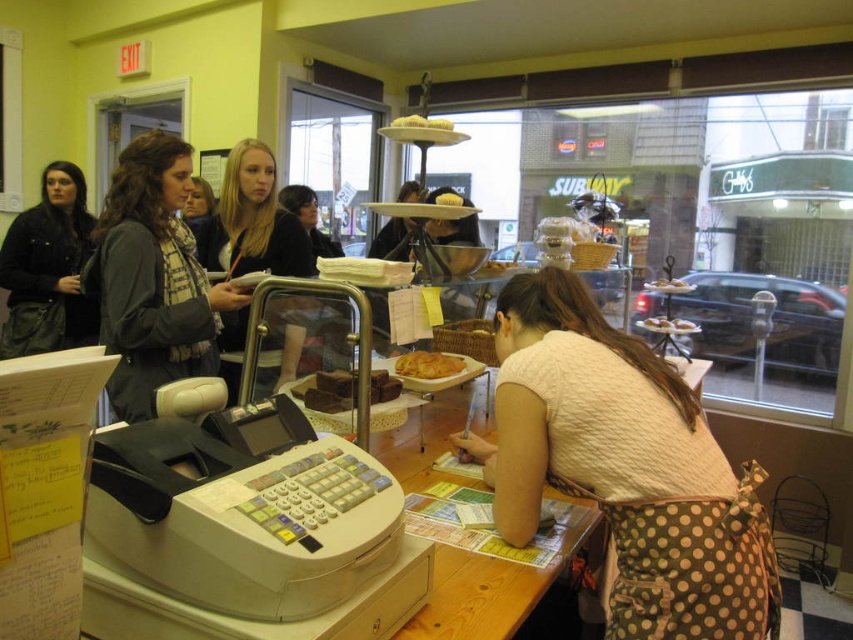
Question: Does dark gray scarf at left appear over white frosted donut at center?

Choices:
 (A) yes
 (B) no

Answer: (A)

Question: Which object is positioned closest to the matte black jacket at left?

Choices:
 (A) matte black scarf at center
 (B) chocolate cake at center

Answer: (A)

Question: Where is matte black scarf at center located in relation to chocolate cake at center in the image?

Choices:
 (A) below
 (B) above

Answer: (B)

Question: Among these objects, which one is nearest to the camera?

Choices:
 (A) white frosted donut at center
 (B) dark gray scarf at left
 (C) white frosted cake at center

Answer: (C)

Question: Does white frosted donut at center appear on the right side of matte brown bread at center?

Choices:
 (A) yes
 (B) no

Answer: (A)

Question: Which object appears closest to the camera in this image?

Choices:
 (A) light pink textured blouse at center
 (B) chocolate cake at center

Answer: (A)